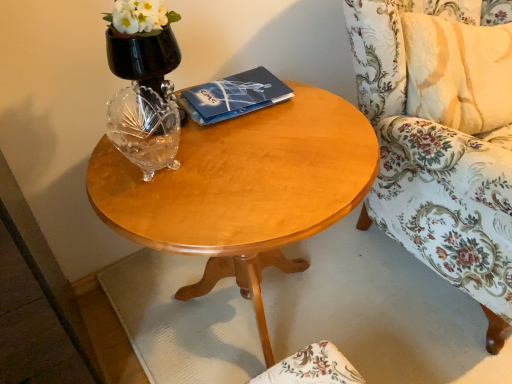
The height and width of the screenshot is (384, 512). What are the coordinates of `free space in front of dark blue matte paper at center` in the screenshot? It's located at (246, 142).